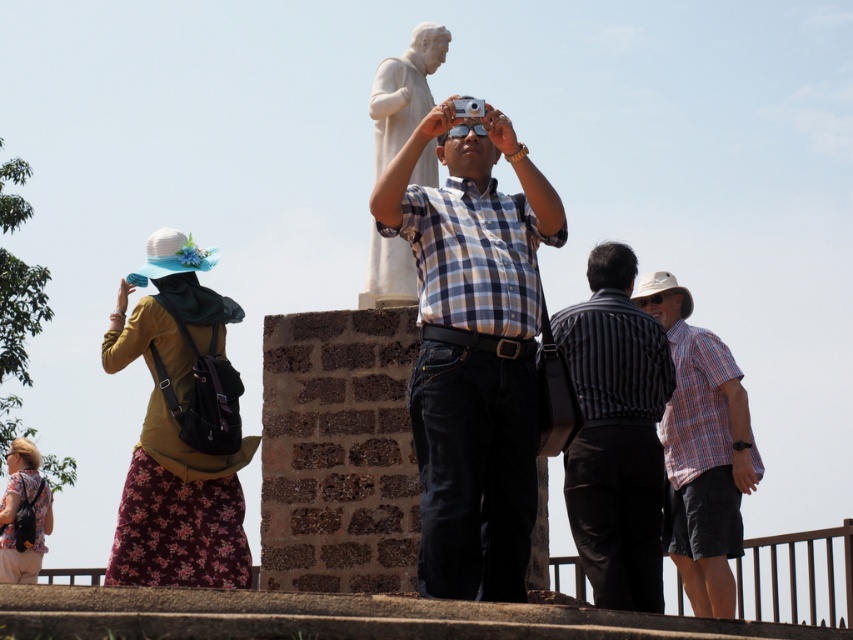
You are a photographer trying to capture a photo of the statue. You notice the plaid shirt at center and the matte black backpack at lower left in the frame. Which object should you adjust your focus to ensure the statue is clearly visible in the background?

The plaid shirt at center is much taller than the matte black backpack at lower left, so adjusting focus to the plaid shirt at center would ensure the statue in the background is clearly visible.

You are a photographer trying to capture the striped shirt at center and the matte black backpack at lower left in a single frame. Given that your camera has a fixed focal length, which object should you focus on to ensure both are in the frame?

Since the striped shirt at center is larger in size than the matte black backpack at lower left, you should focus on the striped shirt at center to ensure both are in the frame.